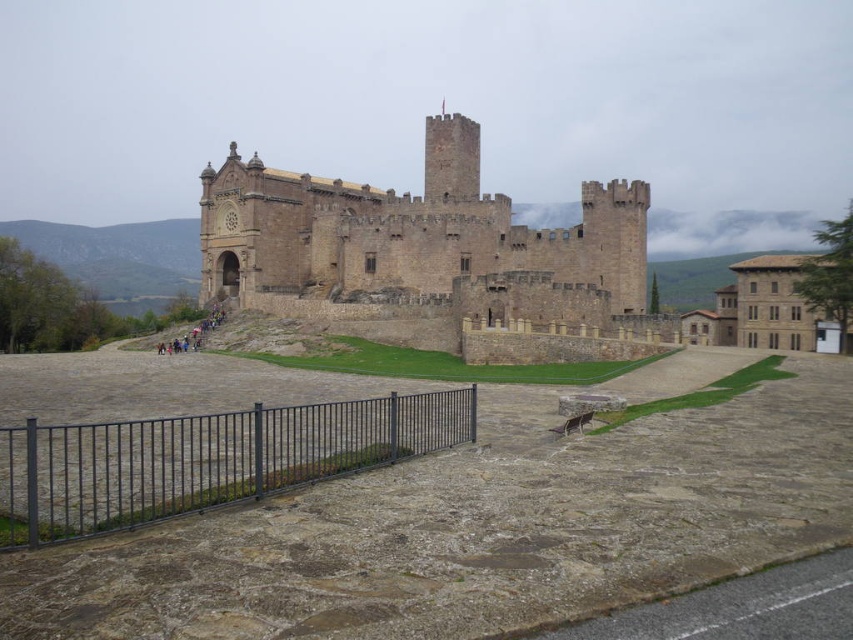
Looking at this image, measure the distance between brown stone castle at center and camera.

They are 84.97 meters apart.

Which of these two, brown stone castle at center or black metal fence at lower left, stands taller?

Standing taller between the two is brown stone castle at center.

The width and height of the screenshot is (853, 640). Identify the location of brown stone castle at center. (418, 248).